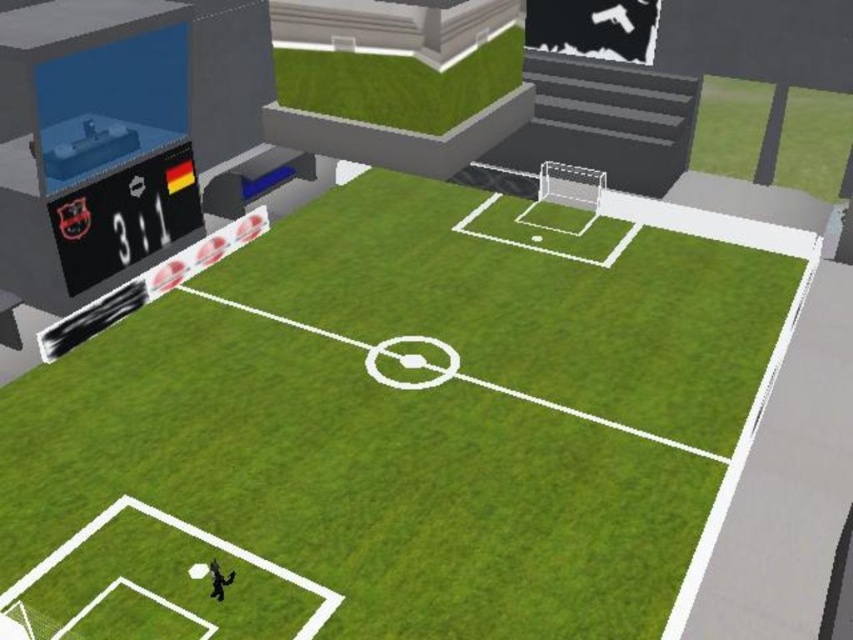
You are playing a soccer game and need to kick the ball to the center of the field. According to the coordinates provided, where exactly should you aim to hit the green grass football field at center?

You should aim for the coordinates point at (415, 419) to hit the green grass football field at center.

You are standing at the point marked as point (74, 440) on the soccer field. The scoreboard shows a score of 3 to 1. If you want to walk towards the goal that is currently leading, which direction should you head towards?

The point (74, 440) is 12.01 meters away from the viewer. Since the scoreboard shows 3 to 1, the leading goal is the one with 3. To reach the leading goal, you should walk towards the direction of the scoreboard, which is likely near the goal with the higher score.

Based on the photo, you are a soccer player standing on the green grass football field at center and looking towards the shiny black scoreboard at upper left. Which direction should you walk to reach the scoreboard?

The green grass football field at center is positioned under the shiny black scoreboard at upper left, so you should walk upwards to reach the scoreboard.